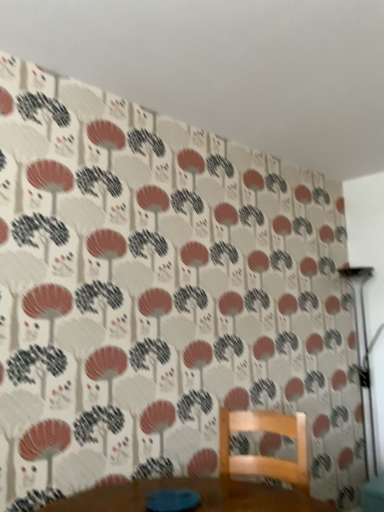
Question: From a real-world perspective, does wooden chair at center sit lower than metallic silver table lamp at right?

Choices:
 (A) yes
 (B) no

Answer: (A)

Question: Considering the relative sizes of wooden chair at center and metallic silver table lamp at right in the image provided, is wooden chair at center taller than metallic silver table lamp at right?

Choices:
 (A) no
 (B) yes

Answer: (A)

Question: Is wooden chair at center closer to camera compared to metallic silver table lamp at right?

Choices:
 (A) no
 (B) yes

Answer: (B)

Question: From the image's perspective, would you say wooden chair at center is positioned over metallic silver table lamp at right?

Choices:
 (A) yes
 (B) no

Answer: (B)

Question: Can you confirm if wooden chair at center is wider than metallic silver table lamp at right?

Choices:
 (A) yes
 (B) no

Answer: (A)

Question: Considering the relative positions of wooden chair at center and metallic silver table lamp at right in the image provided, is wooden chair at center behind metallic silver table lamp at right?

Choices:
 (A) yes
 (B) no

Answer: (B)

Question: From the image's perspective, is metallic silver table lamp at right under wooden chair at center?

Choices:
 (A) yes
 (B) no

Answer: (B)

Question: Is metallic silver table lamp at right surrounding wooden chair at center?

Choices:
 (A) no
 (B) yes

Answer: (A)

Question: Is metallic silver table lamp at right at the right side of wooden chair at center?

Choices:
 (A) no
 (B) yes

Answer: (B)

Question: Does metallic silver table lamp at right turn towards wooden chair at center?

Choices:
 (A) yes
 (B) no

Answer: (A)

Question: From a real-world perspective, is metallic silver table lamp at right over wooden chair at center?

Choices:
 (A) no
 (B) yes

Answer: (B)

Question: Are metallic silver table lamp at right and wooden chair at center beside each other?

Choices:
 (A) no
 (B) yes

Answer: (A)

Question: Does point (365, 407) appear closer or farther from the camera than point (306, 481)?

Choices:
 (A) closer
 (B) farther

Answer: (B)